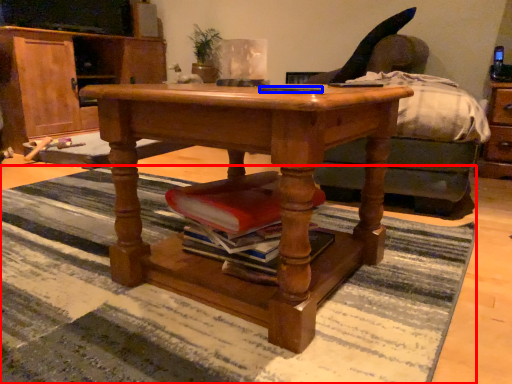
Question: Which point is closer to the camera, mat (highlighted by a red box) or remote control (highlighted by a blue box)?

Choices:
 (A) mat
 (B) remote control

Answer: (A)